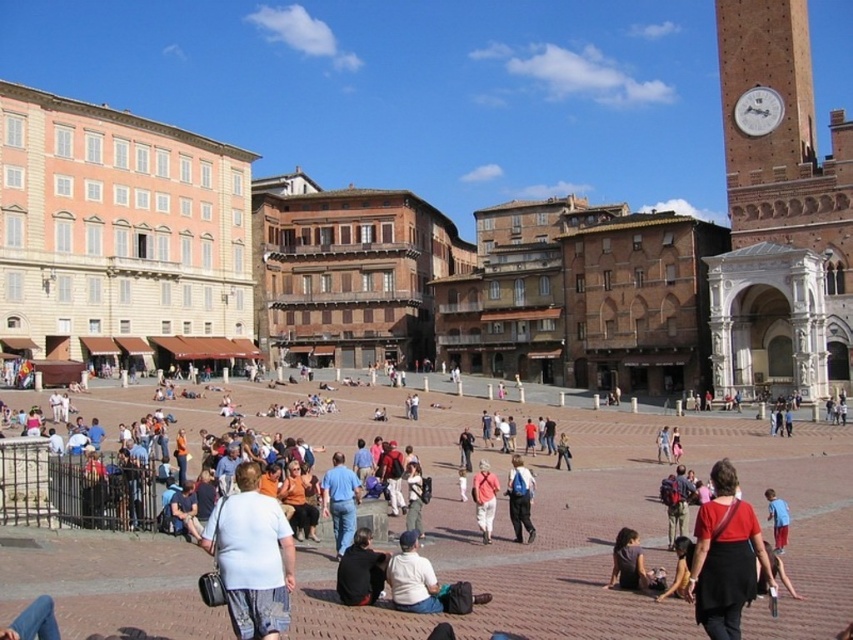
Question: Which of the following is the farthest from the observer?

Choices:
 (A) (282, 612)
 (B) (712, 632)

Answer: (A)

Question: Is dark gray fabric shirt at lower center to the right of blue shirt at center from the viewer's perspective?

Choices:
 (A) no
 (B) yes

Answer: (A)

Question: Which object is positioned farthest from the light blue cotton shirt at center?

Choices:
 (A) matte blue backpack at center
 (B) matte red shirt at lower right
 (C) blue shirt at center
 (D) dark gray fabric shirt at lower center

Answer: (C)

Question: Is matte red shirt at lower right bigger than blue shirt at center?

Choices:
 (A) no
 (B) yes

Answer: (B)

Question: Among these objects, which one is nearest to the camera?

Choices:
 (A) blue shirt at center
 (B) dark blue jeans at center

Answer: (B)

Question: Observing the image, what is the correct spatial positioning of dark gray fabric shirt at lower center in reference to blue shirt at center?

Choices:
 (A) right
 (B) left

Answer: (B)